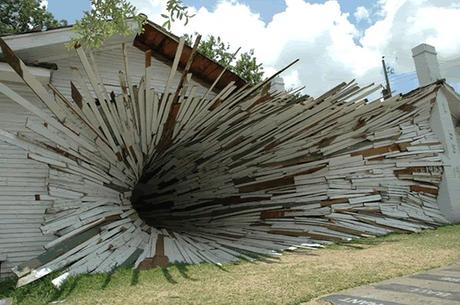
Locate an element on the screen. cable is located at coordinates (410, 79).